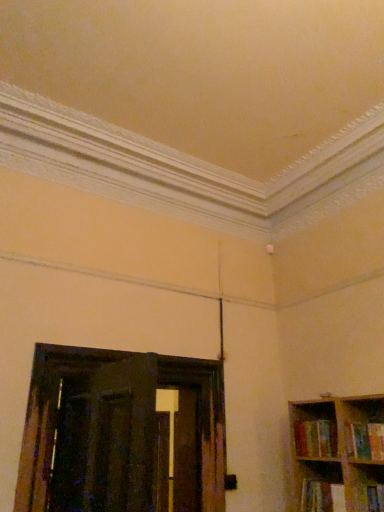
Question: Considering the relative sizes of multicolored fabric book at lower right, which appears as the third book when viewed from the top, and hardcover book at right, which is the first book from top to bottom, in the image provided, is multicolored fabric book at lower right, which appears as the third book when viewed from the top, smaller than hardcover book at right, which is the first book from top to bottom,?

Choices:
 (A) yes
 (B) no

Answer: (A)

Question: Is multicolored fabric book at lower right, which appears as the third book when viewed from the top, facing towards hardcover book at right, which is the first book from top to bottom?

Choices:
 (A) no
 (B) yes

Answer: (A)

Question: Is multicolored fabric book at lower right, the 1th book positioned from the bottom, facing away from hardcover book at right, acting as the 3th book starting from the bottom?

Choices:
 (A) yes
 (B) no

Answer: (B)

Question: From a real-world perspective, is multicolored fabric book at lower right, which appears as the third book when viewed from the top, over hardcover book at right, acting as the 3th book starting from the bottom?

Choices:
 (A) no
 (B) yes

Answer: (A)

Question: Is multicolored fabric book at lower right, the 1th book positioned from the bottom, closer to camera compared to hardcover book at right, which is the first book from top to bottom?

Choices:
 (A) yes
 (B) no

Answer: (B)

Question: Considering the relative sizes of multicolored fabric book at lower right, the 1th book positioned from the bottom, and hardcover book at right, acting as the 3th book starting from the bottom, in the image provided, is multicolored fabric book at lower right, the 1th book positioned from the bottom, wider than hardcover book at right, acting as the 3th book starting from the bottom,?

Choices:
 (A) no
 (B) yes

Answer: (A)

Question: Can you confirm if multicolored fabric book at lower right, the 1th book positioned from the bottom, is shorter than multicolored paperbacks at right, the second book when ordered from bottom to top?

Choices:
 (A) yes
 (B) no

Answer: (A)

Question: Is multicolored fabric book at lower right, which appears as the third book when viewed from the top, aimed at multicolored paperbacks at right, the second book when ordered from bottom to top?

Choices:
 (A) yes
 (B) no

Answer: (B)

Question: From the image's perspective, is multicolored fabric book at lower right, which appears as the third book when viewed from the top, on top of multicolored paperbacks at right, the second book when ordered from bottom to top?

Choices:
 (A) yes
 (B) no

Answer: (B)

Question: Considering the relative sizes of multicolored fabric book at lower right, which appears as the third book when viewed from the top, and multicolored paperbacks at right, which is counted as the second book, starting from the top, in the image provided, is multicolored fabric book at lower right, which appears as the third book when viewed from the top, wider than multicolored paperbacks at right, which is counted as the second book, starting from the top,?

Choices:
 (A) yes
 (B) no

Answer: (B)

Question: From the image's perspective, would you say multicolored fabric book at lower right, which appears as the third book when viewed from the top, is shown under multicolored paperbacks at right, which is counted as the second book, starting from the top?

Choices:
 (A) no
 (B) yes

Answer: (B)

Question: Would you say multicolored fabric book at lower right, the 1th book positioned from the bottom, is outside multicolored paperbacks at right, which is counted as the second book, starting from the top?

Choices:
 (A) no
 (B) yes

Answer: (B)

Question: Is multicolored paperbacks at right, the second book when ordered from bottom to top, positioned far away from multicolored fabric book at lower right, the 1th book positioned from the bottom?

Choices:
 (A) no
 (B) yes

Answer: (A)